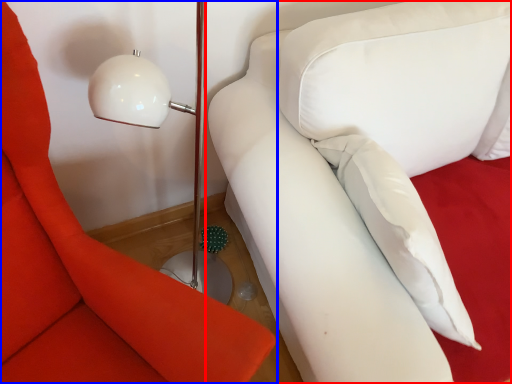
Question: Which of the following is the closest to the observer, studio couch (highlighted by a red box) or furniture (highlighted by a blue box)?

Choices:
 (A) studio couch
 (B) furniture

Answer: (B)